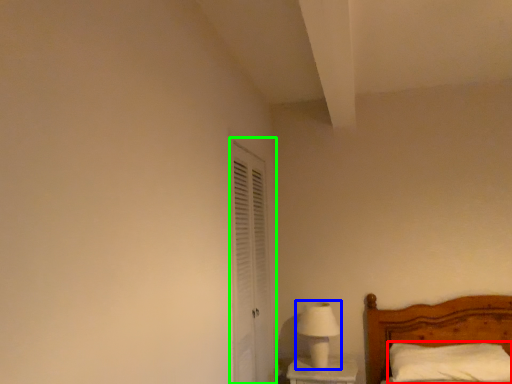
Question: Which is farther away from pillow (highlighted by a red box)? table lamp (highlighted by a blue box) or screen door (highlighted by a green box)?

Choices:
 (A) table lamp
 (B) screen door

Answer: (B)